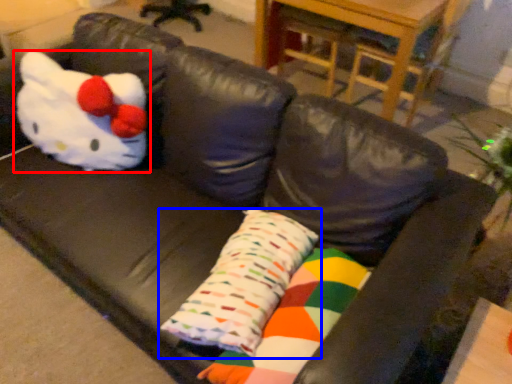
Question: Among these objects, which one is nearest to the camera, toy (highlighted by a red box) or pillow (highlighted by a blue box)?

Choices:
 (A) toy
 (B) pillow

Answer: (B)